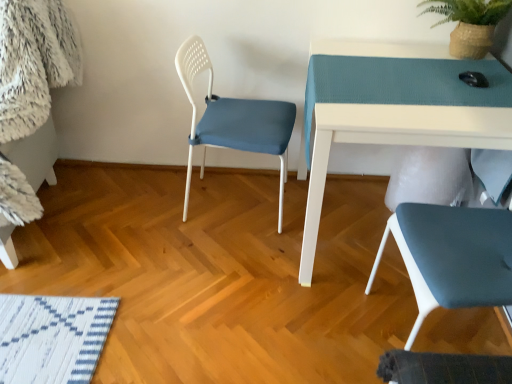
Question: Does green woven basket at upper right lie behind white plastic chair at center, which is the second chair from right to left?

Choices:
 (A) no
 (B) yes

Answer: (B)

Question: From a real-world perspective, is green woven basket at upper right physically below white plastic chair at center, acting as the first chair starting from the left?

Choices:
 (A) no
 (B) yes

Answer: (A)

Question: Could you tell me if green woven basket at upper right is facing white plastic chair at center, acting as the first chair starting from the left?

Choices:
 (A) yes
 (B) no

Answer: (B)

Question: Is green woven basket at upper right bigger than white plastic chair at center, acting as the first chair starting from the left?

Choices:
 (A) no
 (B) yes

Answer: (A)

Question: Is green woven basket at upper right wider than white plastic chair at center, which is the second chair from right to left?

Choices:
 (A) no
 (B) yes

Answer: (A)

Question: Based on their positions, is white glossy table at upper right located to the left or right of matte blue chair at lower right, which appears as the second chair when viewed from the left?

Choices:
 (A) left
 (B) right

Answer: (A)

Question: Is point (368, 137) positioned closer to the camera than point (412, 334)?

Choices:
 (A) closer
 (B) farther

Answer: (A)

Question: Is white glossy table at upper right in front of or behind matte blue chair at lower right, which appears as the second chair when viewed from the left, in the image?

Choices:
 (A) behind
 (B) front

Answer: (A)

Question: From the image's perspective, is white glossy table at upper right located above or below matte blue chair at lower right, placed as the 1th chair when sorted from right to left?

Choices:
 (A) below
 (B) above

Answer: (B)

Question: From the image's perspective, relative to white plastic chair at center, acting as the first chair starting from the left, is green woven basket at upper right above or below?

Choices:
 (A) above
 (B) below

Answer: (A)

Question: Looking at the image, does green woven basket at upper right seem bigger or smaller compared to white plastic chair at center, which is the second chair from right to left?

Choices:
 (A) big
 (B) small

Answer: (B)

Question: Is green woven basket at upper right taller or shorter than white plastic chair at center, acting as the first chair starting from the left?

Choices:
 (A) short
 (B) tall

Answer: (A)

Question: Considering their positions, is green woven basket at upper right located in front of or behind white plastic chair at center, which is the second chair from right to left?

Choices:
 (A) front
 (B) behind

Answer: (B)

Question: Looking at their shapes, would you say white glossy table at upper right is wider or thinner than green woven basket at upper right?

Choices:
 (A) thin
 (B) wide

Answer: (B)

Question: Considering their positions, is white glossy table at upper right located in front of or behind green woven basket at upper right?

Choices:
 (A) front
 (B) behind

Answer: (A)